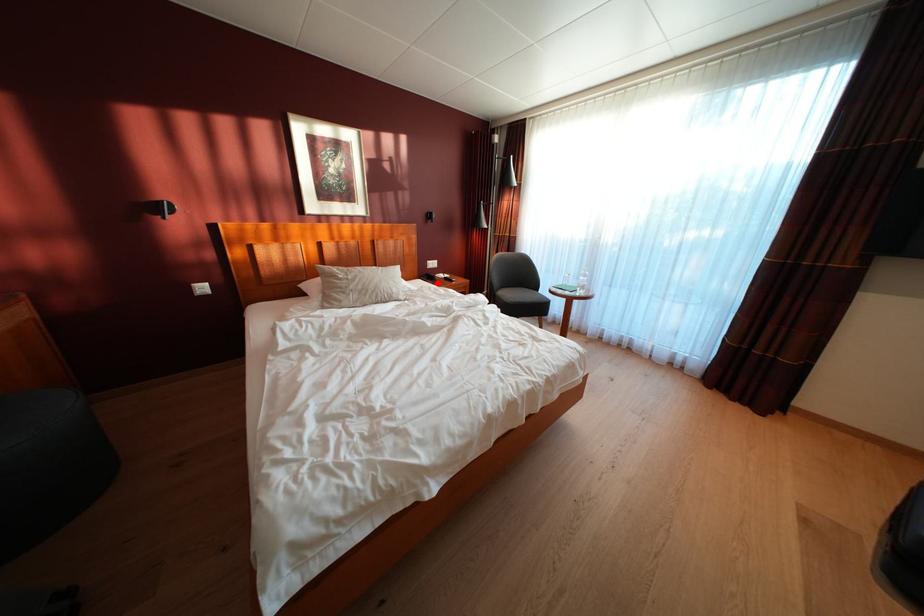
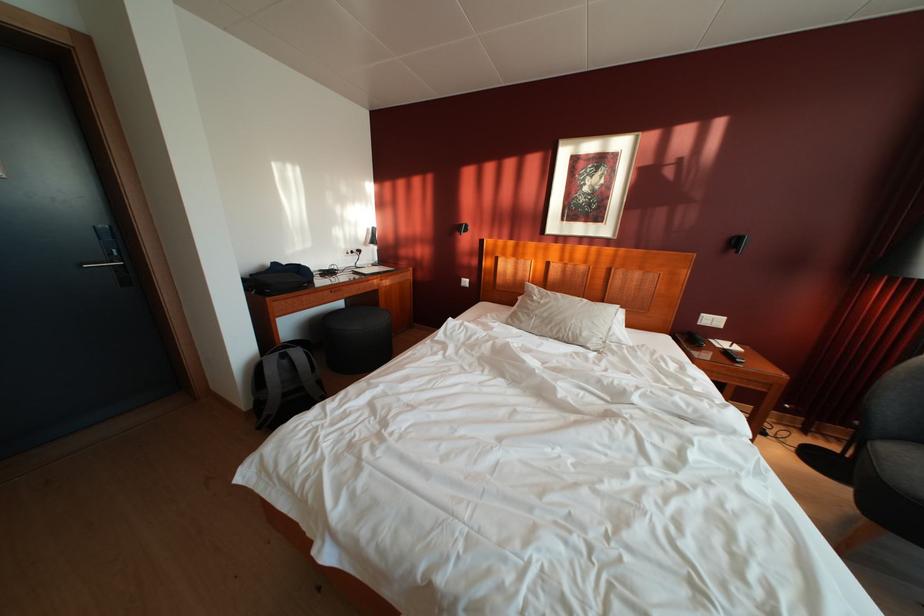
In the second image, find the point that corresponds to the highlighted location in the first image.

(698, 344)